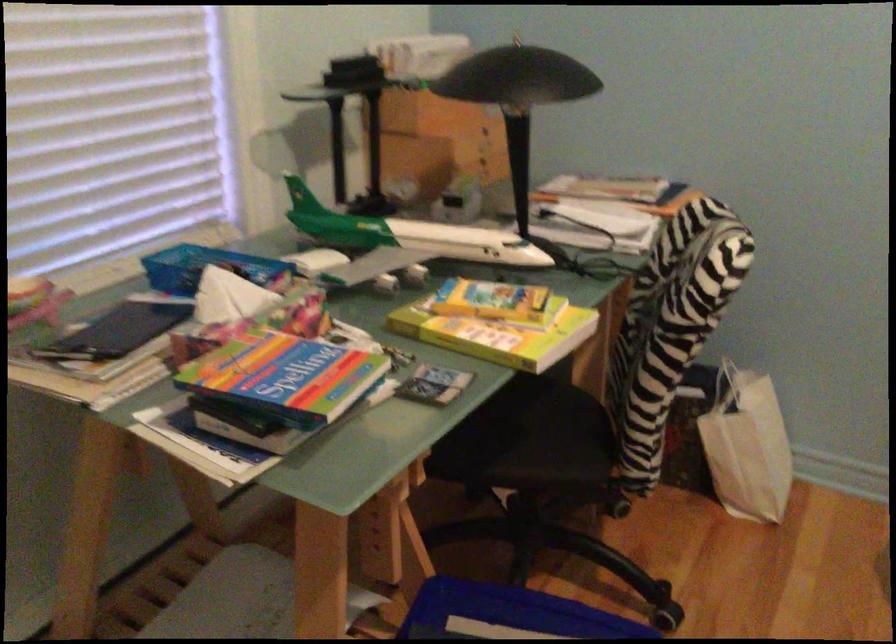
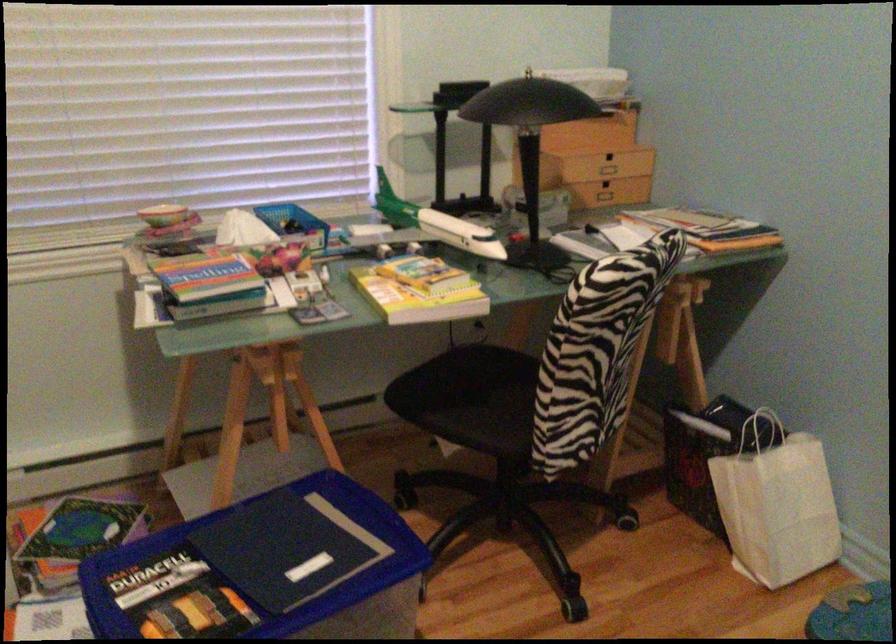
Find the pixel in the second image that matches pixel 722 382 in the first image.

(761, 431)